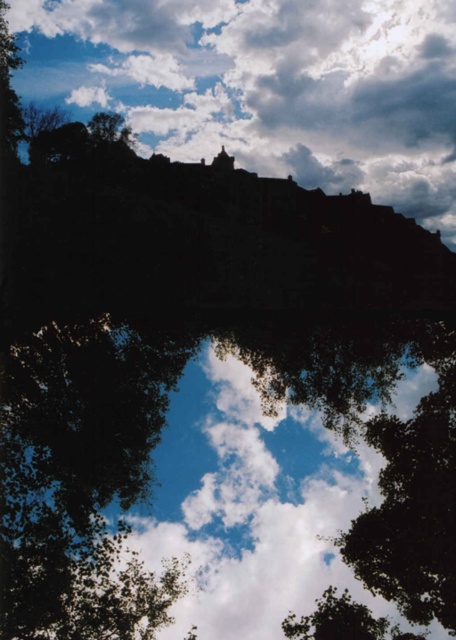
Question: Which of the following is the farthest from the observer?

Choices:
 (A) (98, 115)
 (B) (346, 81)

Answer: (B)

Question: In this image, where is white fluffy cloud at upper center located relative to green leafy tree at upper center?

Choices:
 (A) above
 (B) below

Answer: (A)

Question: Which of the following is the closest to the observer?

Choices:
 (A) (202, 51)
 (B) (124, 132)

Answer: (B)

Question: Is white fluffy cloud at upper center smaller than green leafy tree at upper center?

Choices:
 (A) no
 (B) yes

Answer: (A)

Question: Does white fluffy cloud at upper center lie behind green leafy tree at upper center?

Choices:
 (A) no
 (B) yes

Answer: (B)